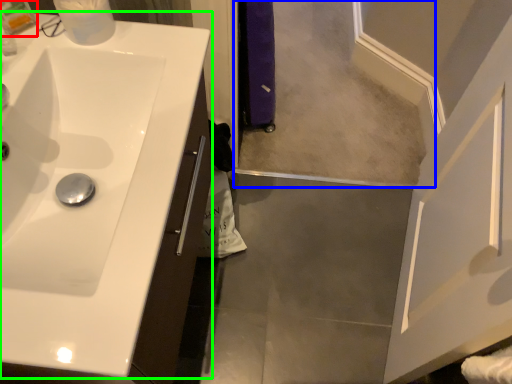
Question: Which object is positioned closest to toiletry (highlighted by a red box)? Select from mirror (highlighted by a blue box) and sink (highlighted by a green box).

Choices:
 (A) mirror
 (B) sink

Answer: (B)